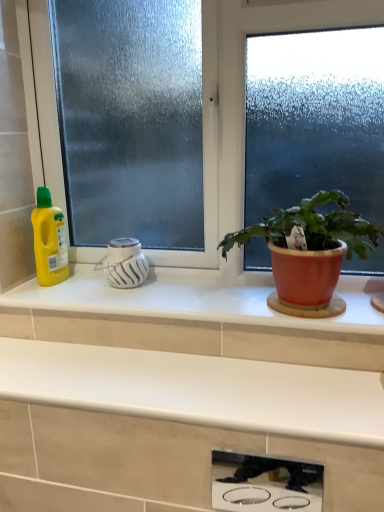
Locate an element on the screen. spots to the right of white matte diffuser at center, which is the 1th appliance from back to front is located at coordinates (179, 291).